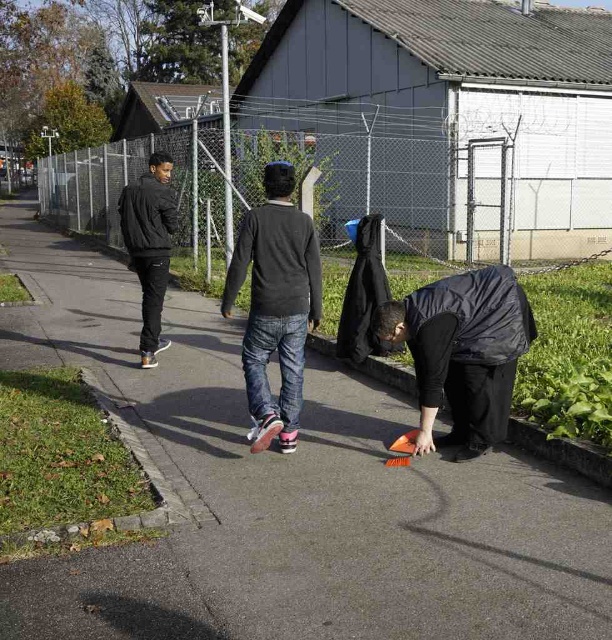
Consider the image. Does smooth asphalt pavement at center have a greater width compared to black matte jacket at left?

Yes, smooth asphalt pavement at center is wider than black matte jacket at left.

Does smooth asphalt pavement at center have a lesser width compared to black matte jacket at left?

In fact, smooth asphalt pavement at center might be wider than black matte jacket at left.

What do you see at coordinates (288, 496) in the screenshot? I see `smooth asphalt pavement at center` at bounding box center [288, 496].

What are the coordinates of `smooth asphalt pavement at center` in the screenshot? It's located at (288, 496).

Which is more to the left, black matte jacket at lower right or black matte jacket at left?

black matte jacket at left is more to the left.

Where is `black matte jacket at lower right`? The width and height of the screenshot is (612, 640). black matte jacket at lower right is located at coordinates (463, 353).

Find the location of a particular element. The width and height of the screenshot is (612, 640). black matte jacket at lower right is located at coordinates (463, 353).

Is point (412, 336) farther from viewer compared to point (307, 237)?

No.

Is point (442, 288) closer to viewer compared to point (266, 348)?

Yes.

Measure the distance between black matte jacket at lower right and camera.

black matte jacket at lower right is 4.36 meters from camera.

Identify the location of black matte jacket at lower right. The height and width of the screenshot is (640, 612). (463, 353).